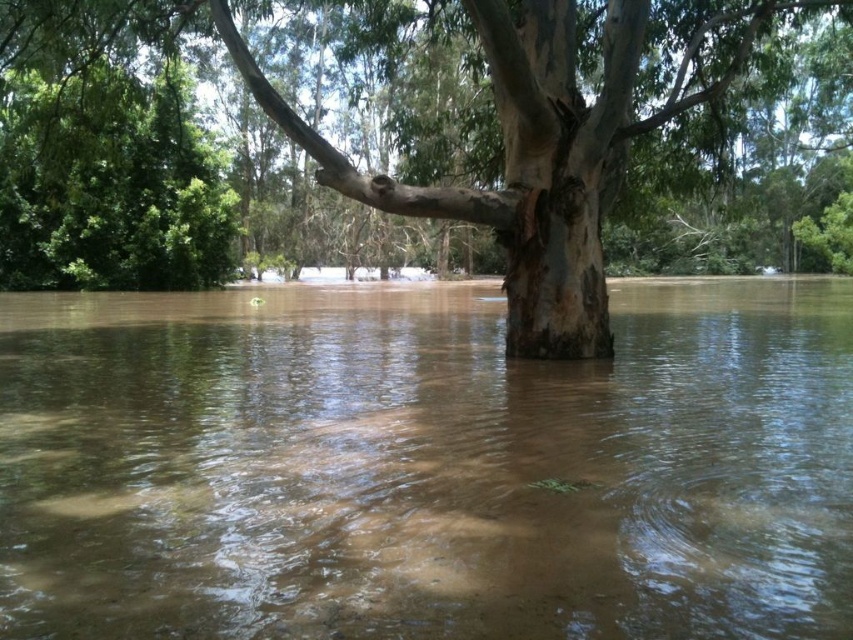
Question: Can you confirm if brown muddy water at center is smaller than brown rough bark tree at center?

Choices:
 (A) yes
 (B) no

Answer: (A)

Question: In this image, where is brown muddy water at center located relative to brown rough bark tree at center?

Choices:
 (A) right
 (B) left

Answer: (B)

Question: Is brown muddy water at center smaller than brown rough bark tree at center?

Choices:
 (A) no
 (B) yes

Answer: (B)

Question: Which point is closer to the camera?

Choices:
 (A) brown rough bark tree at center
 (B) brown muddy water at center

Answer: (B)

Question: Which point is closer to the camera taking this photo?

Choices:
 (A) (463, 470)
 (B) (561, 323)

Answer: (A)

Question: Which point is farther to the camera?

Choices:
 (A) (604, 3)
 (B) (86, 480)

Answer: (A)